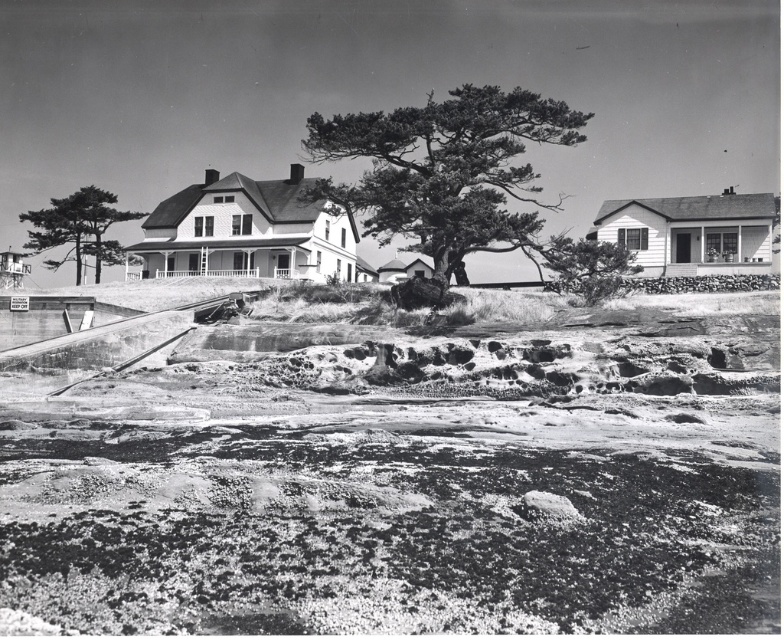
Question: Considering the real-world distances, which object is closest to the smooth bark tree at center?

Choices:
 (A) scaly bark tree at center
 (B) rocky terrain at lower center
 (C) smooth bark tree at left

Answer: (A)

Question: Is scaly bark tree at center smaller than smooth bark tree at left?

Choices:
 (A) no
 (B) yes

Answer: (A)

Question: Which of the following is the closest to the observer?

Choices:
 (A) rocky terrain at lower center
 (B) scaly bark tree at center

Answer: (A)

Question: Can you confirm if smooth bark tree at left is positioned to the right of smooth bark tree at center?

Choices:
 (A) yes
 (B) no

Answer: (B)

Question: Is rocky terrain at lower center thinner than smooth bark tree at left?

Choices:
 (A) no
 (B) yes

Answer: (B)

Question: Based on their relative distances, which object is nearer to the rocky terrain at lower center?

Choices:
 (A) smooth bark tree at left
 (B) smooth bark tree at center

Answer: (B)